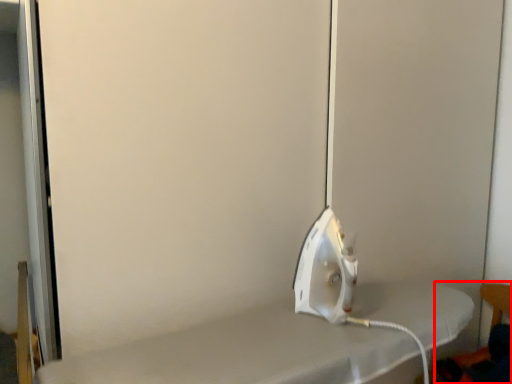
Question: Where is chair (annotated by the red box) located in relation to appliance in the image?

Choices:
 (A) right
 (B) left

Answer: (A)